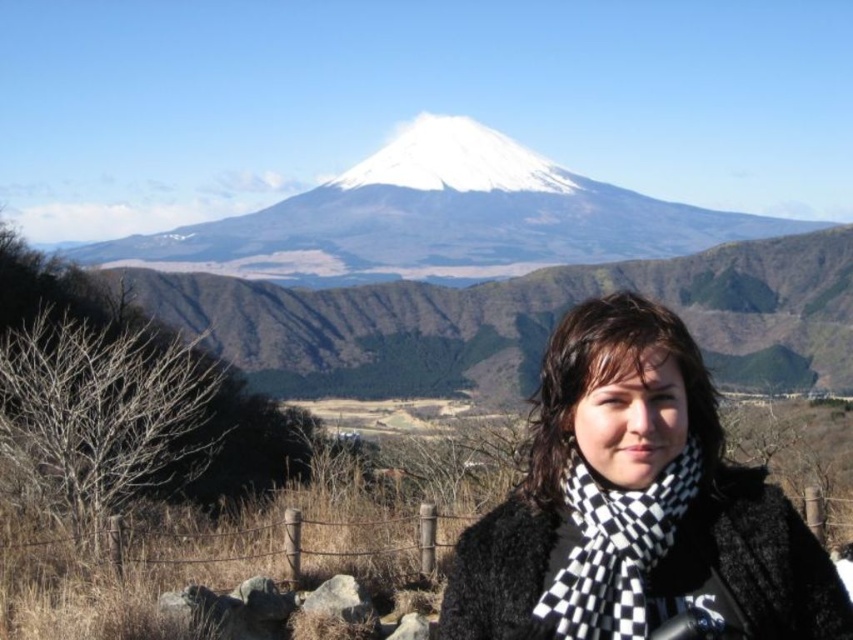
Question: Is black checkered scarf at center positioned before black checkered scarf at lower right?

Choices:
 (A) no
 (B) yes

Answer: (B)

Question: Which of the following is the closest to the observer?

Choices:
 (A) (599, 387)
 (B) (671, 534)

Answer: (B)

Question: Can you confirm if black checkered scarf at center is smaller than white snow-covered mountain at upper center?

Choices:
 (A) yes
 (B) no

Answer: (A)

Question: Which point is closer to the camera taking this photo?

Choices:
 (A) (614, 468)
 (B) (636, 221)

Answer: (A)

Question: Is black checkered scarf at center behind black checkered scarf at lower right?

Choices:
 (A) yes
 (B) no

Answer: (B)

Question: Among these objects, which one is nearest to the camera?

Choices:
 (A) black checkered scarf at lower right
 (B) white snow-covered mountain at upper center

Answer: (A)